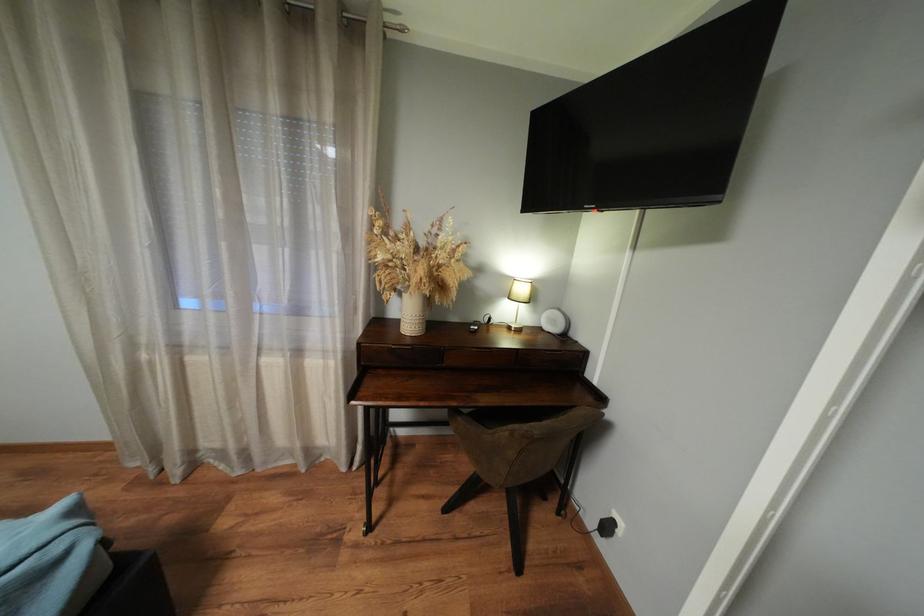
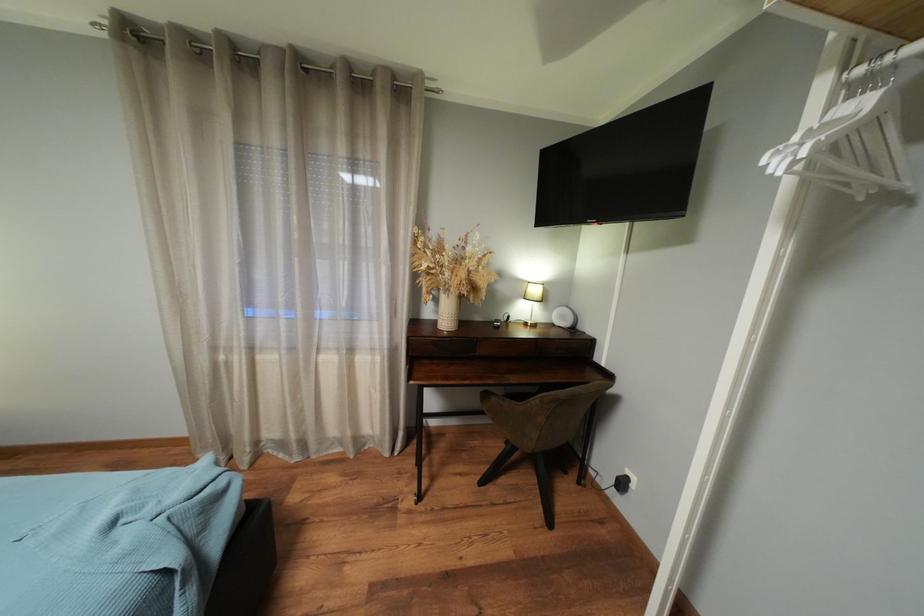
Question: The first image is from the beginning of the video and the second image is from the end. How did the camera likely rotate when shooting the video?

Choices:
 (A) Left
 (B) Right
 (C) Up
 (D) Down

Answer: (C)